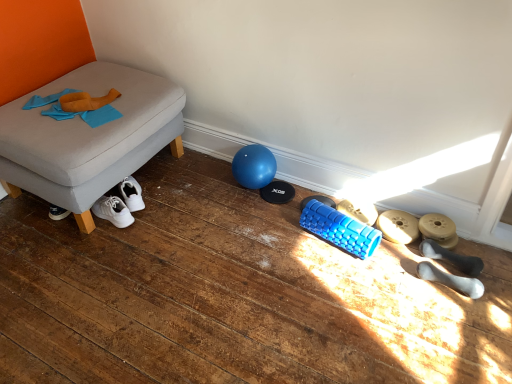
This screenshot has width=512, height=384. Identify the location of vacant space in front of gray fabric ottoman at left. (108, 285).